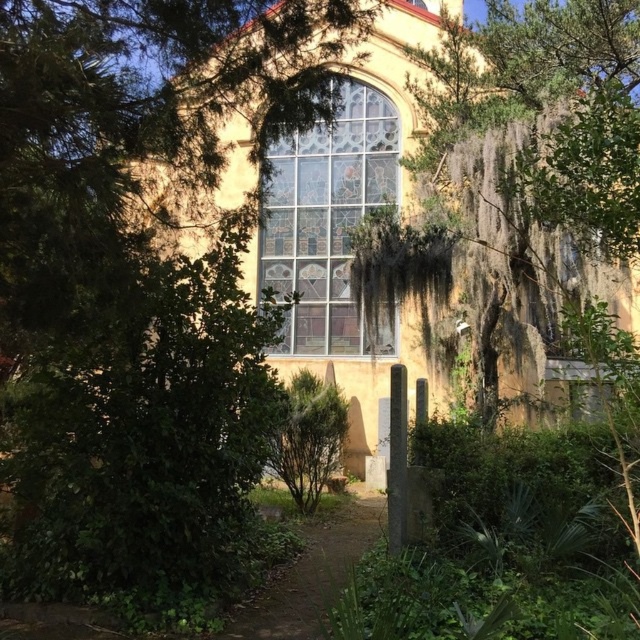
You are a visitor standing in front of the yellow stucco church at center and the brown dirt path at center. Which object is taller?

The yellow stucco church at center is taller than the brown dirt path at center.

You are standing in front of the historic building with the stained glass window. You notice two points marked on the facade. The first point is at coordinates point (564,179), and the second is at point (294,632). Which of these two points is closer to you?

Point (564,179) is closer to the viewer than point (294,632).

You are standing in front of the historic building with the stained glass window. There are two points marked in the scene. Which point, point [557,289] or point [280,220], is closer to you?

Point [557,289] is closer to the camera than point [280,220], so it is closer to you.